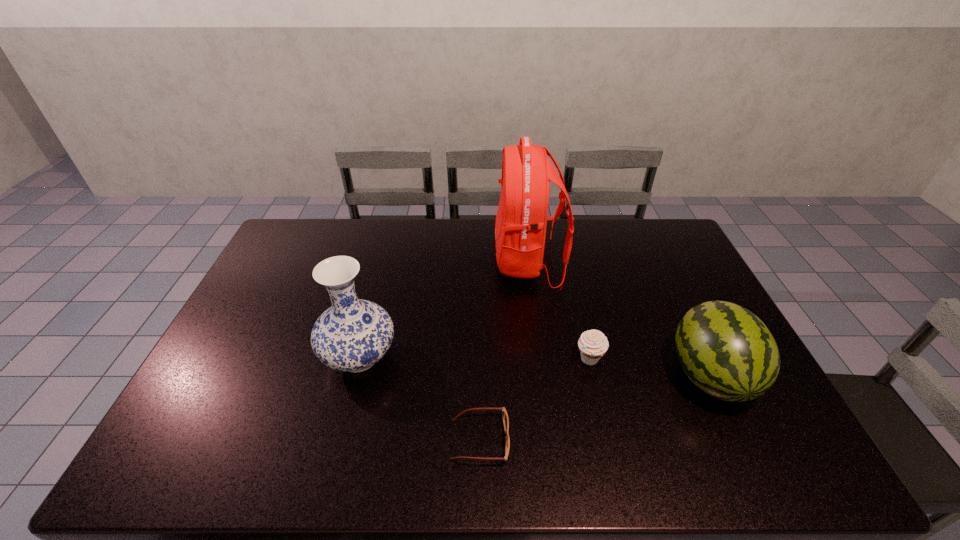
At what (x,y) coordinates should I click in order to perform the action: click on backpack. Please return your answer as a coordinate pair (x, y). The width and height of the screenshot is (960, 540). Looking at the image, I should click on (520, 229).

The image size is (960, 540). In order to click on the tallest object in this screenshot , I will do `click(520, 229)`.

The height and width of the screenshot is (540, 960). In order to click on the leftmost object in this screenshot , I will do `click(353, 334)`.

Locate an element on the screen. the fourth shortest object is located at coordinates (353, 334).

The image size is (960, 540). I want to click on watermelon, so click(x=725, y=350).

Identify the location of the third shortest object. The width and height of the screenshot is (960, 540). (725, 350).

Image resolution: width=960 pixels, height=540 pixels. I want to click on muffin, so click(x=593, y=344).

In order to click on the shortest object in this screenshot , I will do [505, 416].

At what (x,y) coordinates should I click in order to perform the action: click on vacant region located 0.190m on the main compartment of the backpack. Please return your answer as a coordinate pair (x, y). Looking at the image, I should click on (442, 262).

Find the location of a particular element. vacant space located on the main compartment of the backpack is located at coordinates (427, 262).